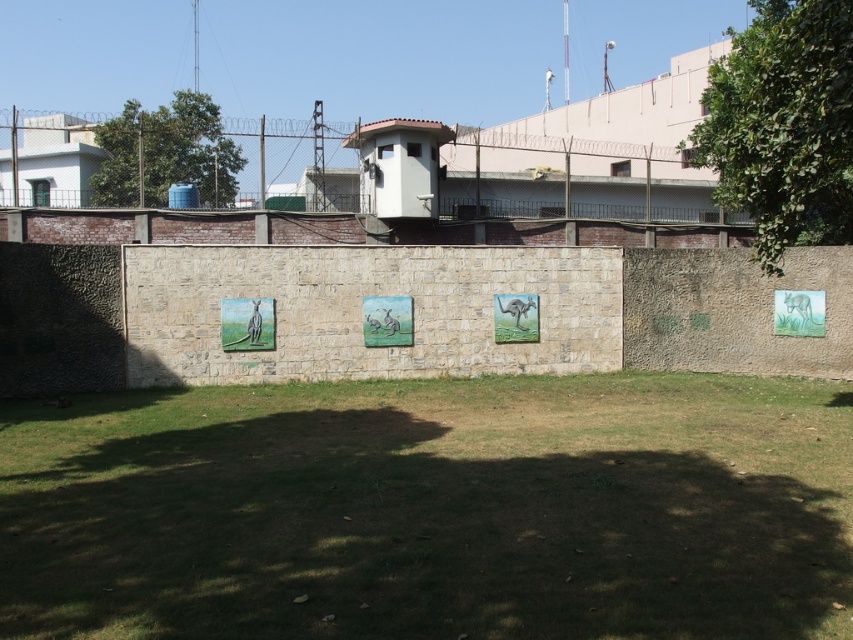
Does green leafy tree at upper left lie in front of pastel acrylic painting of kangaroos at center?

No, it is behind pastel acrylic painting of kangaroos at center.

Between point (149, 168) and point (379, 339), which one is positioned behind?

The point (149, 168) is behind.

Does point (126, 132) lie behind point (379, 304)?

Yes, point (126, 132) is farther from viewer.

Where is `green leafy tree at upper left`? The width and height of the screenshot is (853, 640). green leafy tree at upper left is located at coordinates (166, 154).

Which of these two, green grass at center or green leafy tree at upper right, stands taller?

With more height is green leafy tree at upper right.

Which is behind, point (432, 433) or point (791, 193)?

The point (432, 433) is behind.

Describe the element at coordinates (432, 509) in the screenshot. I see `green grass at center` at that location.

I want to click on green grass at center, so click(x=432, y=509).

Does green glossy kangaroo at right have a larger size compared to matte ceramic camel at center?

Yes, green glossy kangaroo at right is bigger than matte ceramic camel at center.

This screenshot has height=640, width=853. In order to click on green glossy kangaroo at right in this screenshot , I will do `click(799, 312)`.

Describe the element at coordinates (799, 312) in the screenshot. I see `green glossy kangaroo at right` at that location.

Locate an element on the screen. green glossy kangaroo at right is located at coordinates (799, 312).